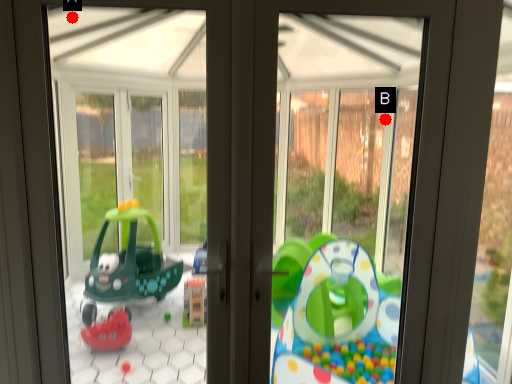
Question: Two points are circled on the image, labeled by A and B beside each circle. Among these points, which one is farthest from the camera?

Choices:
 (A) A is further
 (B) B is further

Answer: (B)